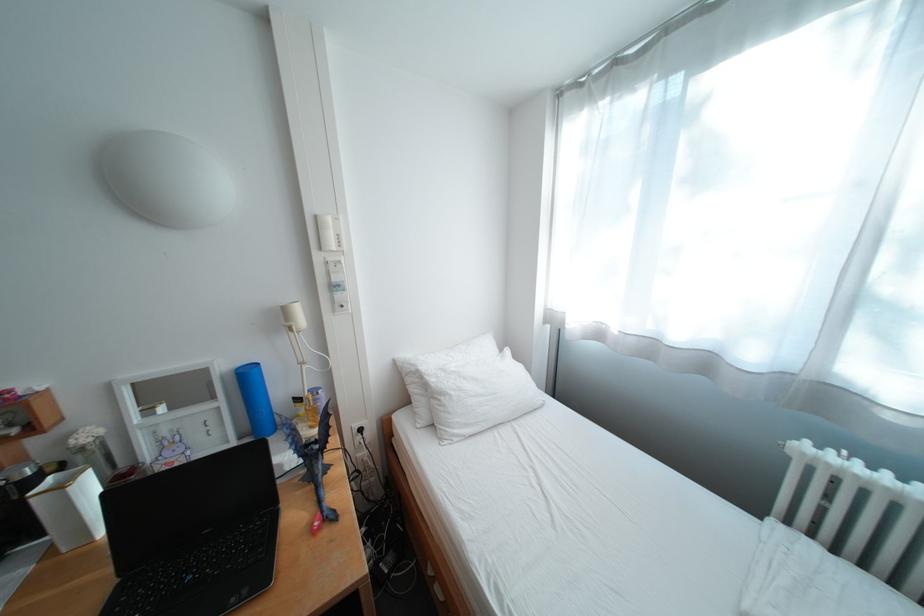
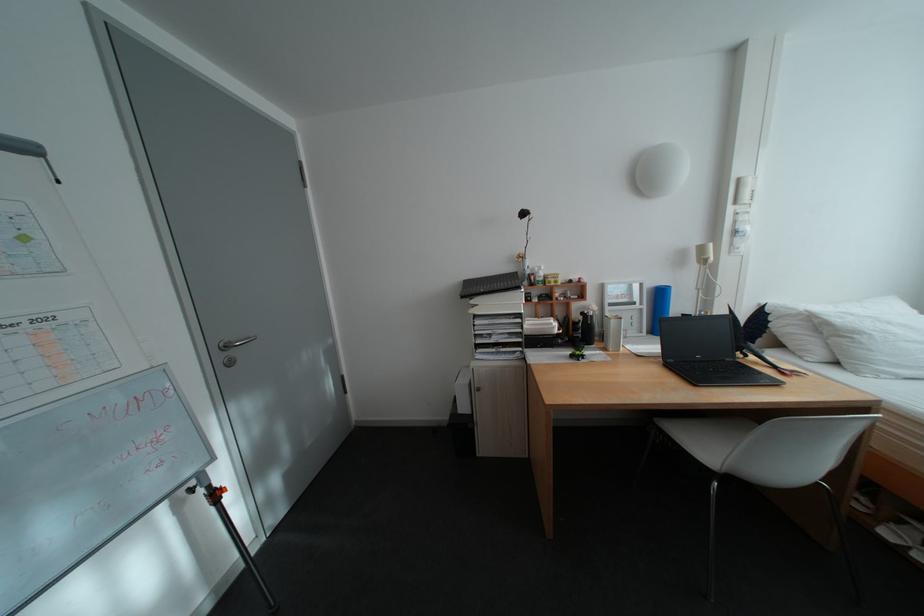
Where in the second image is the point corresponding to (x=456, y=397) from the first image?

(871, 334)